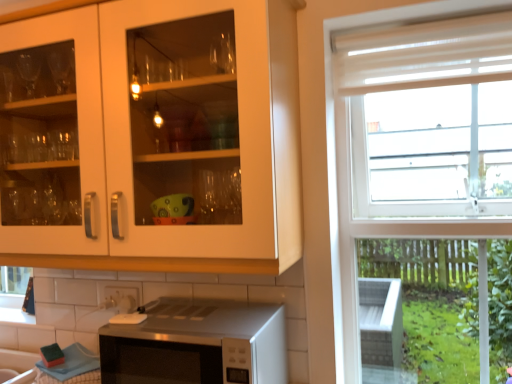
Question: From the image's perspective, is satin silver microwave at lower center above matte white cabinet at upper left?

Choices:
 (A) no
 (B) yes

Answer: (A)

Question: Could you tell me if satin silver microwave at lower center is facing matte white cabinet at upper left?

Choices:
 (A) yes
 (B) no

Answer: (B)

Question: Does satin silver microwave at lower center have a larger size compared to matte white cabinet at upper left?

Choices:
 (A) yes
 (B) no

Answer: (B)

Question: From a real-world perspective, is satin silver microwave at lower center on top of matte white cabinet at upper left?

Choices:
 (A) no
 (B) yes

Answer: (A)

Question: From the image's perspective, is satin silver microwave at lower center below matte white cabinet at upper left?

Choices:
 (A) yes
 (B) no

Answer: (A)

Question: From the image's perspective, is matte white cabinet at upper left positioned above or below white glossy tile at lower center?

Choices:
 (A) below
 (B) above

Answer: (B)

Question: Considering their positions, is matte white cabinet at upper left located in front of or behind white glossy tile at lower center?

Choices:
 (A) front
 (B) behind

Answer: (A)

Question: Which is correct: matte white cabinet at upper left is inside white glossy tile at lower center, or outside of it?

Choices:
 (A) inside
 (B) outside

Answer: (B)

Question: From a real-world perspective, is matte white cabinet at upper left physically located above or below white glossy tile at lower center?

Choices:
 (A) below
 (B) above

Answer: (B)

Question: Considering the positions of matte white cabinet at upper left and sheer white curtain at upper right in the image, is matte white cabinet at upper left wider or thinner than sheer white curtain at upper right?

Choices:
 (A) thin
 (B) wide

Answer: (B)

Question: From a real-world perspective, is matte white cabinet at upper left positioned above or below sheer white curtain at upper right?

Choices:
 (A) above
 (B) below

Answer: (B)

Question: Which is correct: matte white cabinet at upper left is inside sheer white curtain at upper right, or outside of it?

Choices:
 (A) inside
 (B) outside

Answer: (B)

Question: Does point (237, 258) appear closer or farther from the camera than point (492, 43)?

Choices:
 (A) farther
 (B) closer

Answer: (B)

Question: Considering the positions of white glossy tile at lower center and satin silver microwave at lower center in the image, is white glossy tile at lower center taller or shorter than satin silver microwave at lower center?

Choices:
 (A) short
 (B) tall

Answer: (A)

Question: From the image's perspective, is white glossy tile at lower center above or below satin silver microwave at lower center?

Choices:
 (A) below
 (B) above

Answer: (B)